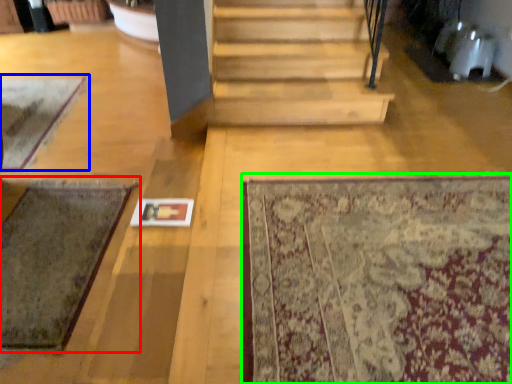
Question: Considering the real-world distances, which object is closest to mat (highlighted by a red box)? mat (highlighted by a blue box) or mat (highlighted by a green box).

Choices:
 (A) mat
 (B) mat

Answer: (A)